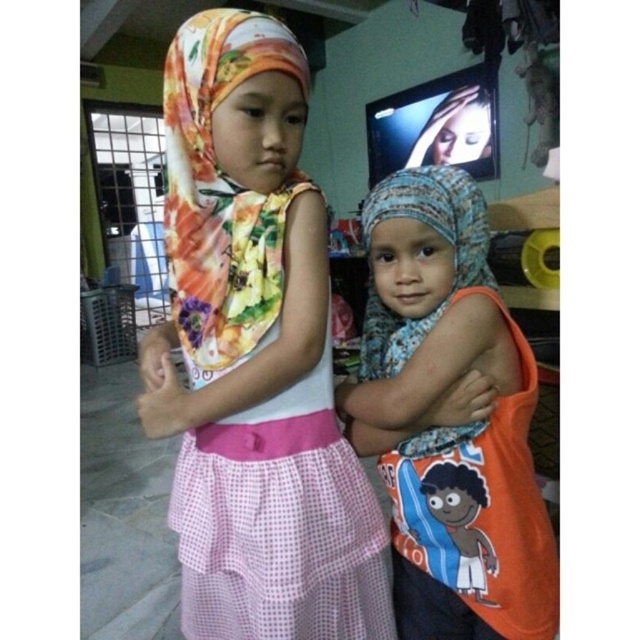
You are standing in the room where the two children are. You want to walk from the point at the bottom right corner of the room to the point at the upper left corner. Which direction should you move? The points are labeled as point [248,600] and point [444,100].

To move from point [248,600] to point [444,100], you should move towards the upper left direction since point [444,100] is located in the upper left relative to point [248,600].

You are a photographer trying to capture a clear shot of the blue printed scarf at center and the smooth skin face at upper right. Based on their sizes in the frame, which one should you focus on first to ensure it appears sharp in the photo?

The blue printed scarf at center is taller than smooth skin face at upper right, so you should focus on the blue printed scarf at center first to ensure it appears sharp since it is larger in the frame.

You are a photographer setting up for a family photo. You need to position two children so that their head coverings are at least 7 inches apart to avoid overlapping in the frame. The children are wearing a floral fabric hijab at upper left and a blue printed scarf at center. Can you place them as required?

The floral fabric hijab at upper left is currently 6.94 inches away from the blue printed scarf at center, which is just slightly less than the required 7 inches. To meet the requirement, you should move them further apart so the distance becomes at least 7 inches.